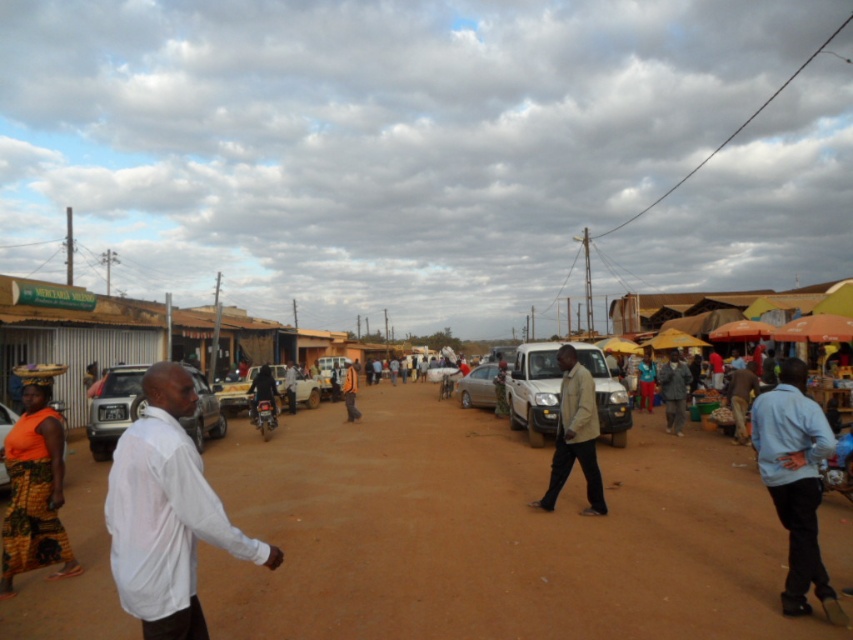
Question: Which of these objects is positioned closest to the light blue shirt at right?

Choices:
 (A) satin silver car at center
 (B) silver metallic car at center-left
 (C) brown dirt field at center

Answer: (C)

Question: Among these objects, which one is farthest from the camera?

Choices:
 (A) orange fabric car at lower left
 (B) orange printed fabric at lower left
 (C) white matte van at center

Answer: (C)

Question: Which point is farther from the camera taking this photo?

Choices:
 (A) (51, 509)
 (B) (310, 400)
 (C) (561, 401)
 (D) (206, 531)

Answer: (B)

Question: Is white matte van at center positioned at the back of white matte car at center?

Choices:
 (A) no
 (B) yes

Answer: (A)

Question: Is orange printed fabric at lower left to the right of white matte van at center from the viewer's perspective?

Choices:
 (A) yes
 (B) no

Answer: (B)

Question: Considering the relative positions of white matte shirt at left and silver metallic car at center-left in the image provided, where is white matte shirt at left located with respect to silver metallic car at center-left?

Choices:
 (A) right
 (B) left

Answer: (A)